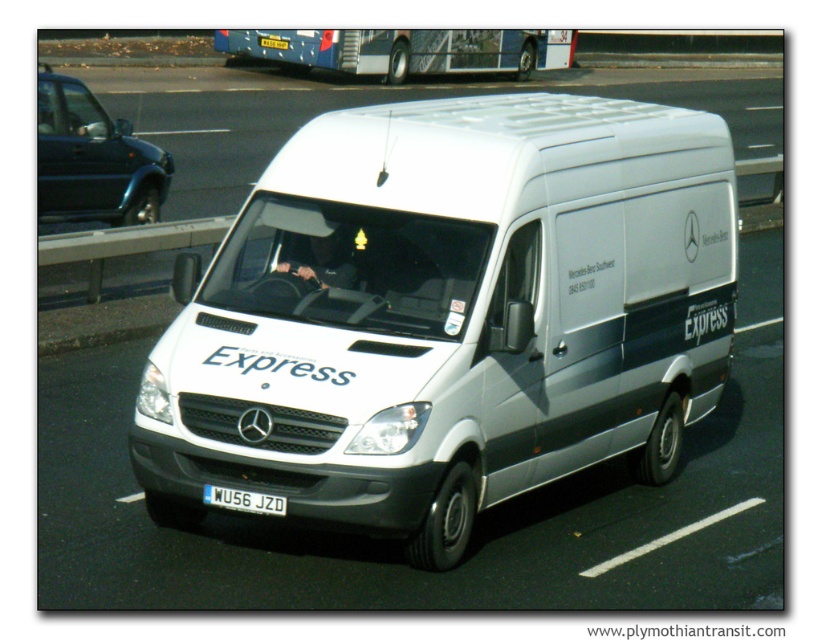
You are standing on the sidewalk and see the white matte van at center approaching you. If the van is moving at 15 km per hour, how many seconds will it take for the van to reach you?

The white matte van at center is 6.40 meters away from the viewer. At a speed of 15 km per hour, it will take approximately 15.36 seconds for the van to reach you.

You are standing on the side of the road and see the van and the bus in the distance. Which of the two points, point (178, 148) or point (266, 512), is closer to you?

Point (178, 148) is closer to you because it is further to the viewer than point (266, 512).